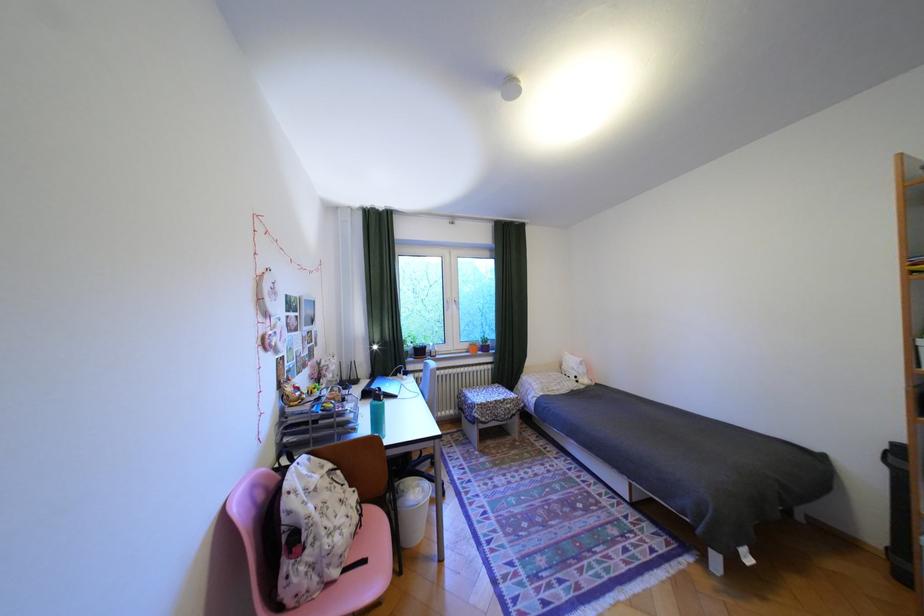
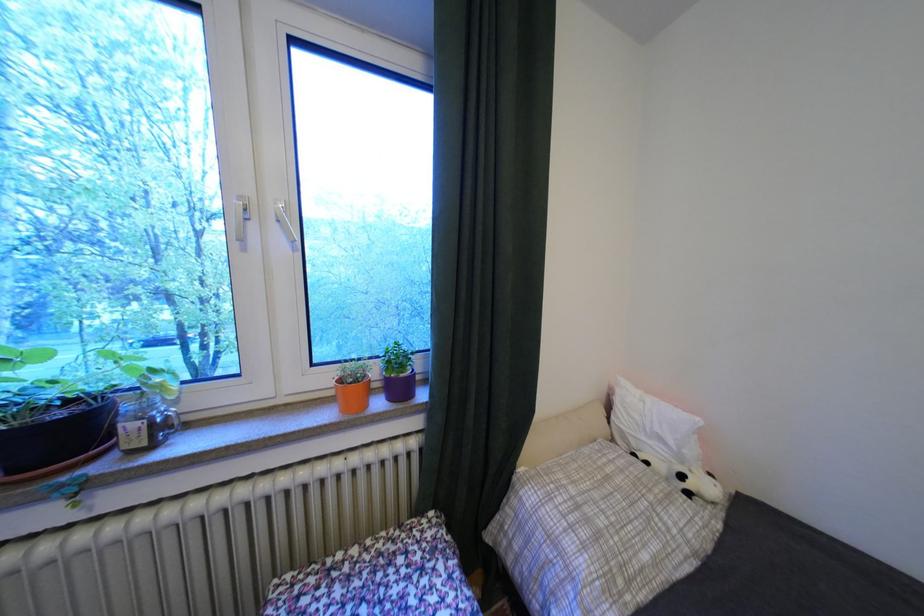
Locate, in the second image, the point that corresponds to point (432, 352) in the first image.

(75, 436)